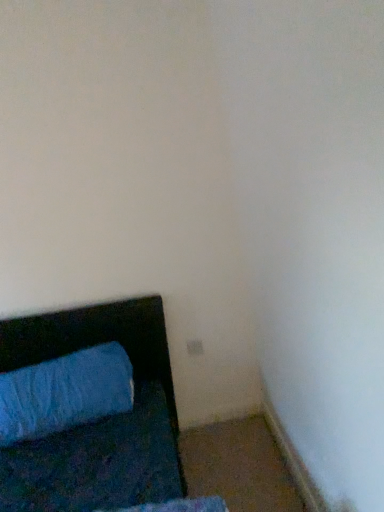
Where is `blue fabric pillow at lower left`? The image size is (384, 512). blue fabric pillow at lower left is located at coordinates (65, 393).

Image resolution: width=384 pixels, height=512 pixels. What do you see at coordinates (65, 393) in the screenshot?
I see `blue fabric pillow at lower left` at bounding box center [65, 393].

This screenshot has height=512, width=384. What are the coordinates of `blue fabric pillow at lower left` in the screenshot? It's located at (65, 393).